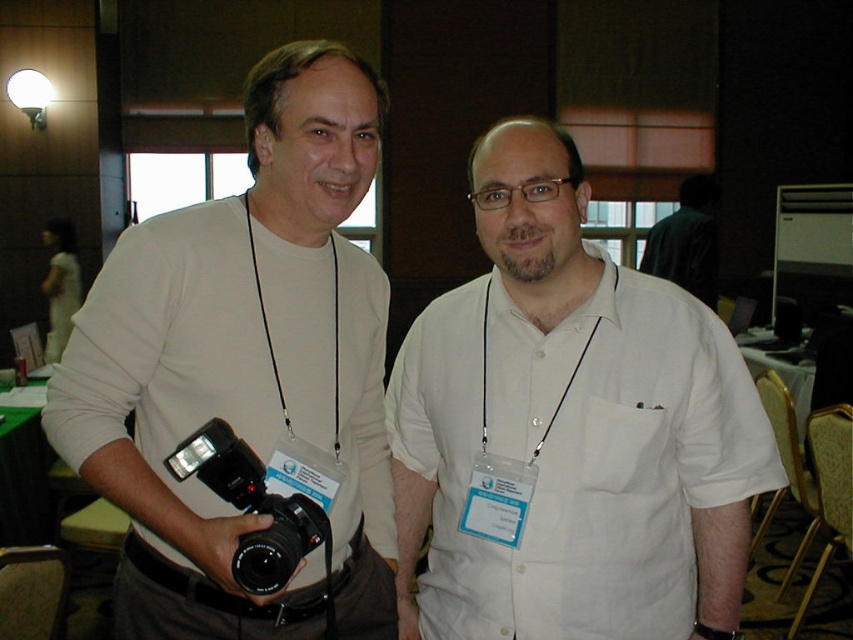
Question: Does matte white camera at left appear under black plastic camera at left?

Choices:
 (A) yes
 (B) no

Answer: (B)

Question: Where is white cotton shirt at center located in relation to black plastic camera at left in the image?

Choices:
 (A) above
 (B) below

Answer: (A)

Question: Does matte white camera at left appear over black plastic camera at left?

Choices:
 (A) no
 (B) yes

Answer: (B)

Question: Which of these objects is positioned farthest from the matte white camera at left?

Choices:
 (A) black plastic camera at left
 (B) white cotton shirt at center

Answer: (B)

Question: Among these points, which one is farthest from the camera?

Choices:
 (A) (265, 490)
 (B) (286, 72)

Answer: (B)

Question: Which point is farther from the camera taking this photo?

Choices:
 (A) (274, 518)
 (B) (537, 540)
 (C) (367, 547)

Answer: (C)